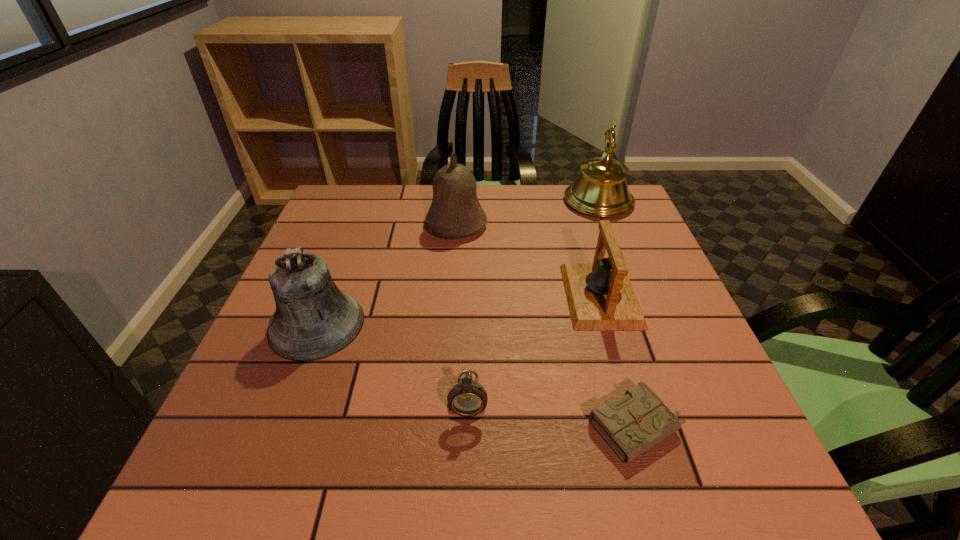
Where is `object that is positioned at the near edge`? The height and width of the screenshot is (540, 960). object that is positioned at the near edge is located at coordinates (633, 424).

Locate an element on the screen. The image size is (960, 540). object that is at the left edge is located at coordinates (313, 320).

At what (x,y) coordinates should I click in order to perform the action: click on diary situated at the right edge. Please return your answer as a coordinate pair (x, y). The image size is (960, 540). Looking at the image, I should click on click(633, 424).

The height and width of the screenshot is (540, 960). I want to click on object that is at the far right corner, so click(x=601, y=189).

The height and width of the screenshot is (540, 960). I want to click on object located at the near right corner, so 633,424.

In the image, there is a desktop. At what (x,y) coordinates should I click in order to perform the action: click on free space at the far edge. Please return your answer as a coordinate pair (x, y). Looking at the image, I should click on (521, 220).

Locate an element on the screen. free space at the near edge is located at coordinates (604, 503).

At what (x,y) coordinates should I click in order to perform the action: click on free space at the left edge of the desktop. Please return your answer as a coordinate pair (x, y). The image size is (960, 540). Looking at the image, I should click on (319, 253).

Where is `vacant space at the right edge of the desktop`? The height and width of the screenshot is (540, 960). vacant space at the right edge of the desktop is located at coordinates (623, 239).

Where is `free space at the far left corner`? The height and width of the screenshot is (540, 960). free space at the far left corner is located at coordinates (373, 211).